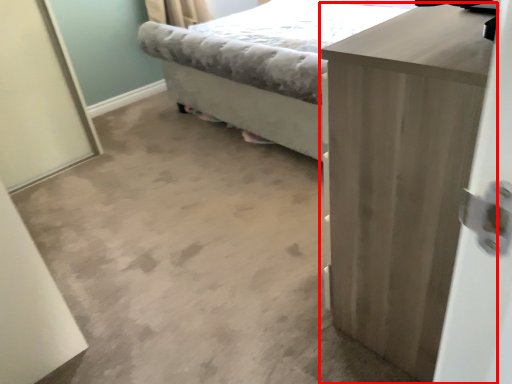
Question: From the image's perspective, what is the correct spatial positioning of chest of drawers (annotated by the red box) in reference to bed?

Choices:
 (A) above
 (B) below

Answer: (B)